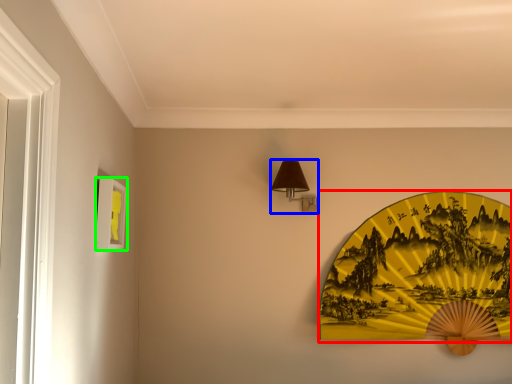
Question: Which object is the closest to the design (highlighted by a red box)? Choose among these: table lamp (highlighted by a blue box) or picture frame (highlighted by a green box).

Choices:
 (A) table lamp
 (B) picture frame

Answer: (A)